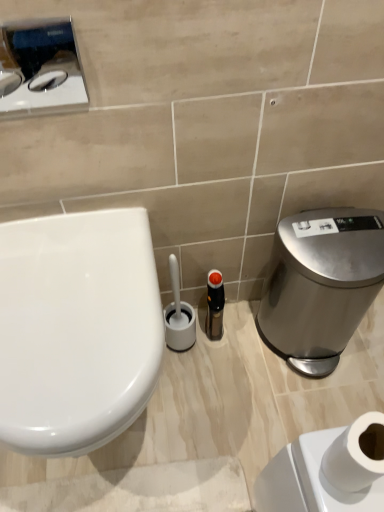
Question: Is brushed metal toilet paper dispenser at upper left outside satin silver trash can at right?

Choices:
 (A) yes
 (B) no

Answer: (A)

Question: From the image's perspective, is brushed metal toilet paper dispenser at upper left on satin silver trash can at right?

Choices:
 (A) no
 (B) yes

Answer: (B)

Question: From a real-world perspective, is brushed metal toilet paper dispenser at upper left physically below satin silver trash can at right?

Choices:
 (A) no
 (B) yes

Answer: (A)

Question: Can you confirm if brushed metal toilet paper dispenser at upper left is shorter than satin silver trash can at right?

Choices:
 (A) no
 (B) yes

Answer: (B)

Question: Are brushed metal toilet paper dispenser at upper left and satin silver trash can at right beside each other?

Choices:
 (A) no
 (B) yes

Answer: (A)

Question: Looking at their shapes, would you say black plastic bottle at center is wider or thinner than white glossy toilet at left?

Choices:
 (A) wide
 (B) thin

Answer: (B)

Question: Is point (221, 320) positioned closer to the camera than point (44, 219)?

Choices:
 (A) closer
 (B) farther

Answer: (B)

Question: In terms of size, does black plastic bottle at center appear bigger or smaller than white glossy toilet at left?

Choices:
 (A) small
 (B) big

Answer: (A)

Question: Is black plastic bottle at center taller or shorter than white glossy toilet at left?

Choices:
 (A) short
 (B) tall

Answer: (A)

Question: From the image's perspective, is brushed metal toilet paper dispenser at upper left located above or below white matte toilet paper at lower right?

Choices:
 (A) below
 (B) above

Answer: (B)

Question: In the image, is brushed metal toilet paper dispenser at upper left positioned in front of or behind white matte toilet paper at lower right?

Choices:
 (A) front
 (B) behind

Answer: (B)

Question: Is brushed metal toilet paper dispenser at upper left wider or thinner than white matte toilet paper at lower right?

Choices:
 (A) thin
 (B) wide

Answer: (A)

Question: Is brushed metal toilet paper dispenser at upper left spatially inside white matte toilet paper at lower right, or outside of it?

Choices:
 (A) inside
 (B) outside

Answer: (B)

Question: From the image's perspective, relative to white glossy toilet at left, is satin silver trash can at right above or below?

Choices:
 (A) below
 (B) above

Answer: (B)

Question: Is satin silver trash can at right taller or shorter than white glossy toilet at left?

Choices:
 (A) tall
 (B) short

Answer: (A)